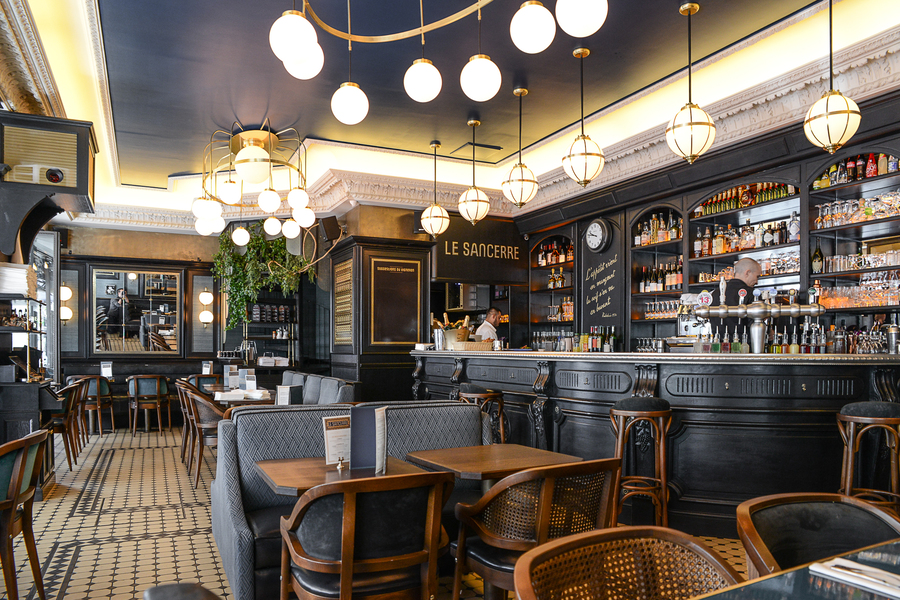
The width and height of the screenshot is (900, 600). What are the coordinates of `crown molding sections` in the screenshot? It's located at (127, 217), (325, 204), (417, 193), (763, 114).